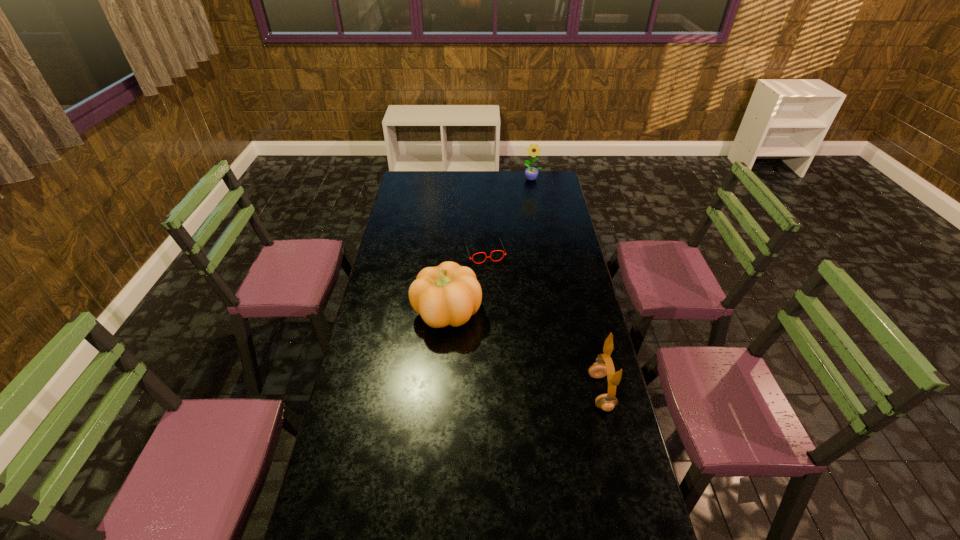
You are a GUI agent. You are given a task and a screenshot of the screen. Output one action in this format:
    pyautogui.click(x=<x>, y=<y>)
    Task: Click on the vacant space located 0.380m on the front-facing side of the shortest object
    
    Given the screenshot: What is the action you would take?
    pyautogui.click(x=510, y=327)

Identify the location of vacant space located on the front-facing side of the farthest object. This screenshot has height=540, width=960. (530, 196).

The width and height of the screenshot is (960, 540). In order to click on vacant space situated 0.220m on the front-facing side of the farthest object in this screenshot , I will do `click(529, 203)`.

Where is `vacant space located on the front-facing side of the farthest object`? vacant space located on the front-facing side of the farthest object is located at coordinates (531, 187).

You are a GUI agent. You are given a task and a screenshot of the screen. Output one action in this format:
    pyautogui.click(x=<x>, y=<y>)
    Task: Click on the object that is at the far edge
    
    Given the screenshot: What is the action you would take?
    pyautogui.click(x=531, y=173)

This screenshot has width=960, height=540. I want to click on earphone located at the right edge, so click(606, 402).

The image size is (960, 540). Identify the location of sunflower present at the right edge. (531, 173).

Image resolution: width=960 pixels, height=540 pixels. In order to click on object that is at the far right corner in this screenshot , I will do `click(531, 173)`.

Identify the location of blank space at the far edge. (439, 178).

Find the location of a particular element. vacant area at the near edge is located at coordinates (516, 522).